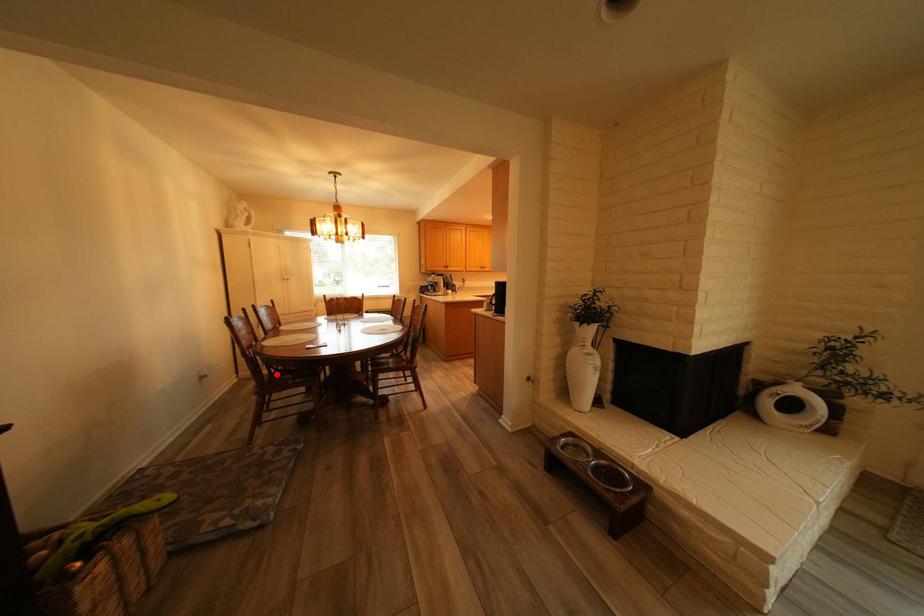
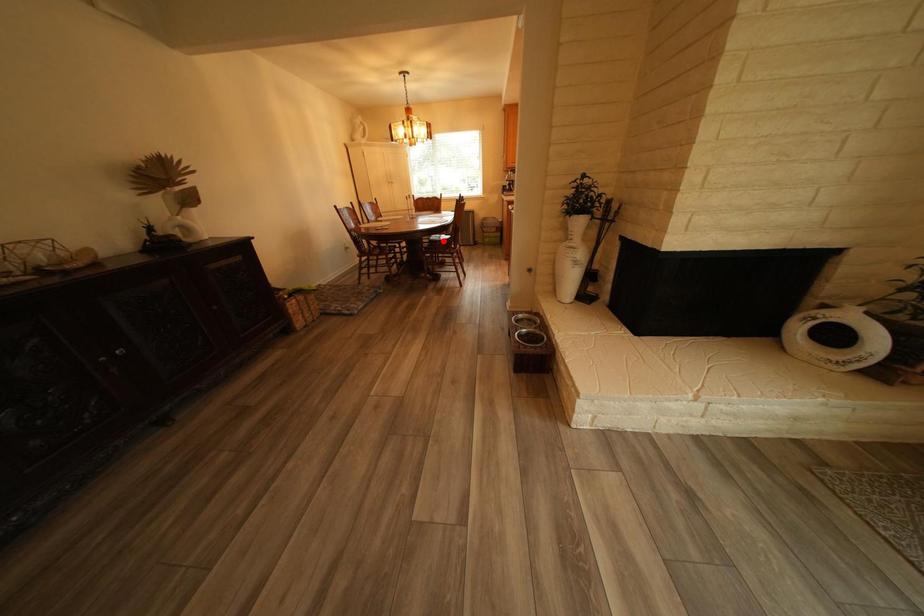
I am providing you with two images of the same scene from different viewpoints. A red point is marked on the first image and another point is marked on the second image. Is the marked point in image1 the same physical position as the marked point in image2?

No